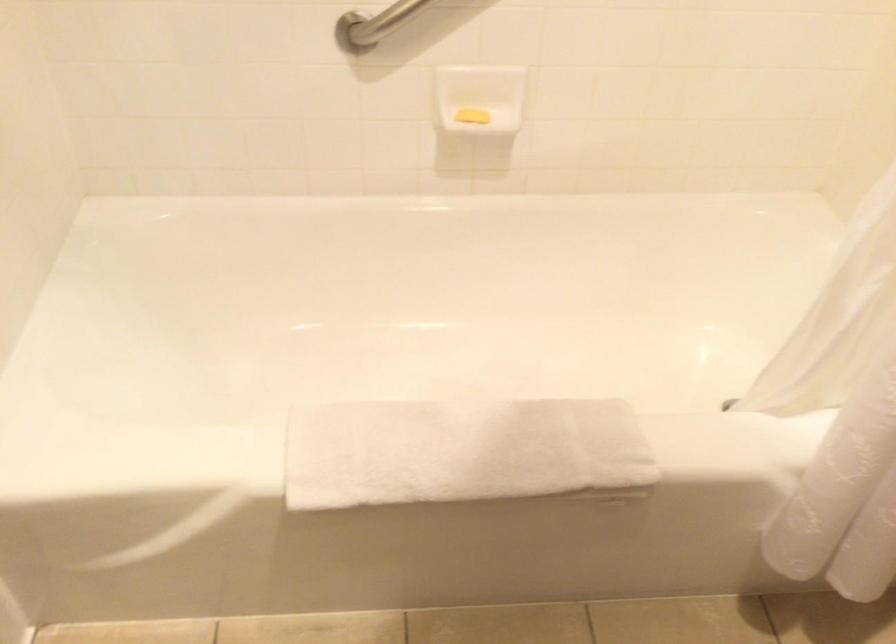
Find where to lift the yellow bar of soap. Please return your answer as a coordinate pair (x, y).

(471, 116)